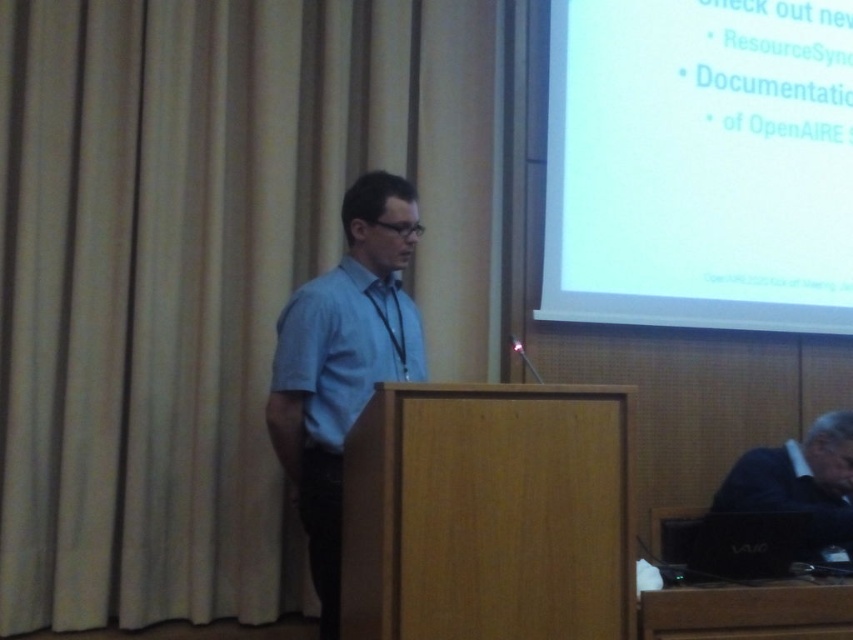
Question: Is white glossy screen at upper right wider than black plastic laptop at lower right?

Choices:
 (A) no
 (B) yes

Answer: (B)

Question: Is white glossy screen at upper right behind light blue shirt at center?

Choices:
 (A) yes
 (B) no

Answer: (A)

Question: Which of the following is the closest to the observer?

Choices:
 (A) black plastic laptop at lower right
 (B) light blue shirt at center
 (C) white glossy screen at upper right

Answer: (B)

Question: Which object is closer to the camera taking this photo?

Choices:
 (A) light blue cotton dress shirt at center
 (B) light blue shirt at center

Answer: (A)

Question: Can you confirm if white glossy screen at upper right is positioned to the left of light blue cotton dress shirt at center?

Choices:
 (A) no
 (B) yes

Answer: (A)

Question: Which object appears farthest from the camera in this image?

Choices:
 (A) light blue shirt at center
 (B) black plastic laptop at lower right

Answer: (B)